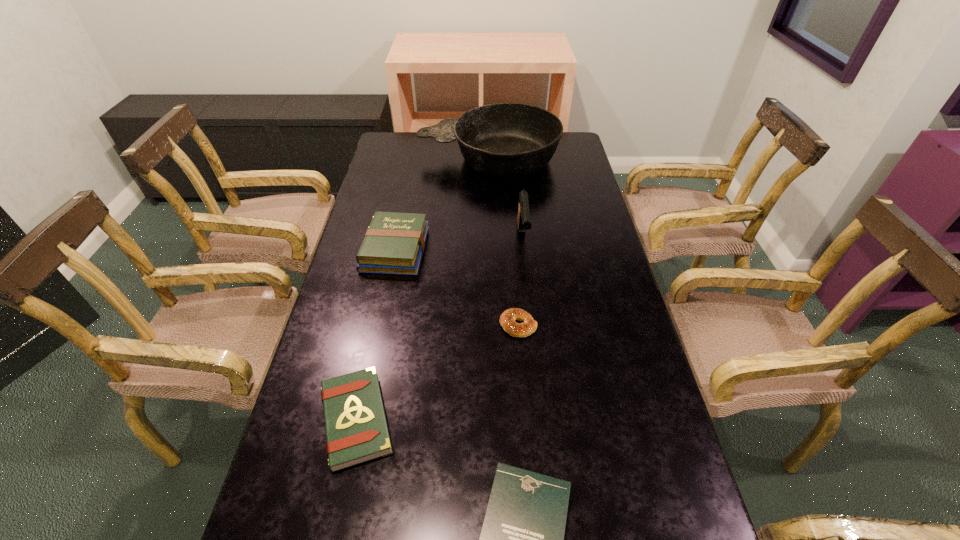
This screenshot has width=960, height=540. I want to click on frying pan, so click(504, 140).

The width and height of the screenshot is (960, 540). Find the location of `pistol`. pistol is located at coordinates (524, 219).

Where is `the tallest book`? the tallest book is located at coordinates (394, 243).

The image size is (960, 540). I want to click on the farthest book, so click(394, 243).

Where is `bagel`? This screenshot has height=540, width=960. bagel is located at coordinates (507, 319).

Locate an element on the screen. The width and height of the screenshot is (960, 540). free point located with the handle extending from the side of the frying pan is located at coordinates (406, 159).

Locate an element on the screen. vacant space located 0.370m at the barrel of the pistol is located at coordinates (535, 356).

Identify the location of vacant space situated on the back of the farthest book. (406, 196).

At what (x,y) coordinates should I click in order to perform the action: click on free location located 0.080m on the front of the fourth farthest object. Please return your answer as a coordinate pair (x, y). Looking at the image, I should click on (521, 365).

Find the location of a particular element. Image resolution: width=960 pixels, height=540 pixels. object located at the far edge is located at coordinates (504, 140).